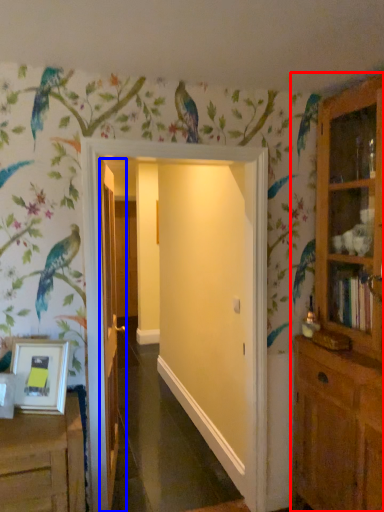
Question: Which object is closer to the camera taking this photo, cupboard (highlighted by a red box) or door (highlighted by a blue box)?

Choices:
 (A) cupboard
 (B) door

Answer: (A)